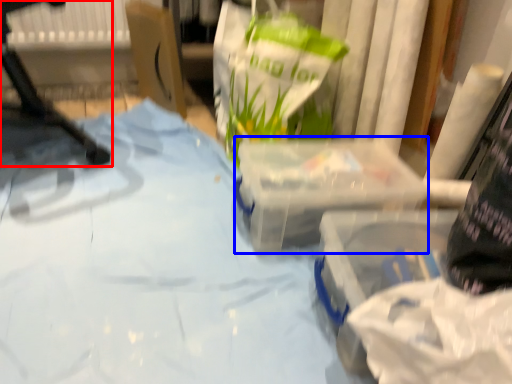
Question: Which object appears farthest to the camera in this image, furniture (highlighted by a red box) or box (highlighted by a blue box)?

Choices:
 (A) furniture
 (B) box

Answer: (B)